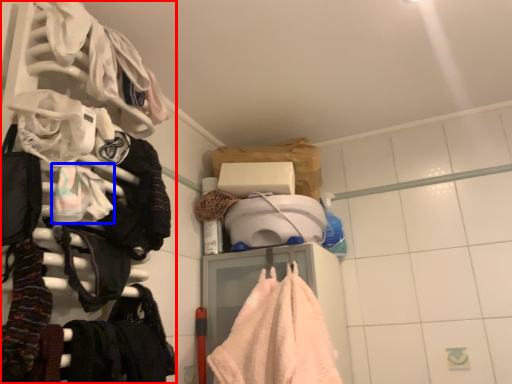
Question: Which point is further to the camera, closet (highlighted by a red box) or clothing (highlighted by a blue box)?

Choices:
 (A) closet
 (B) clothing

Answer: (B)